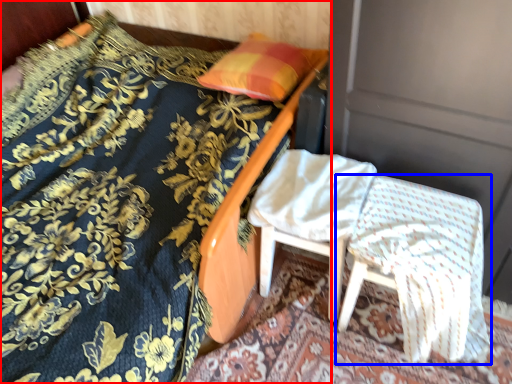
Question: Which object appears farthest to the camera in this image, bed (highlighted by a red box) or chair (highlighted by a blue box)?

Choices:
 (A) bed
 (B) chair

Answer: (B)